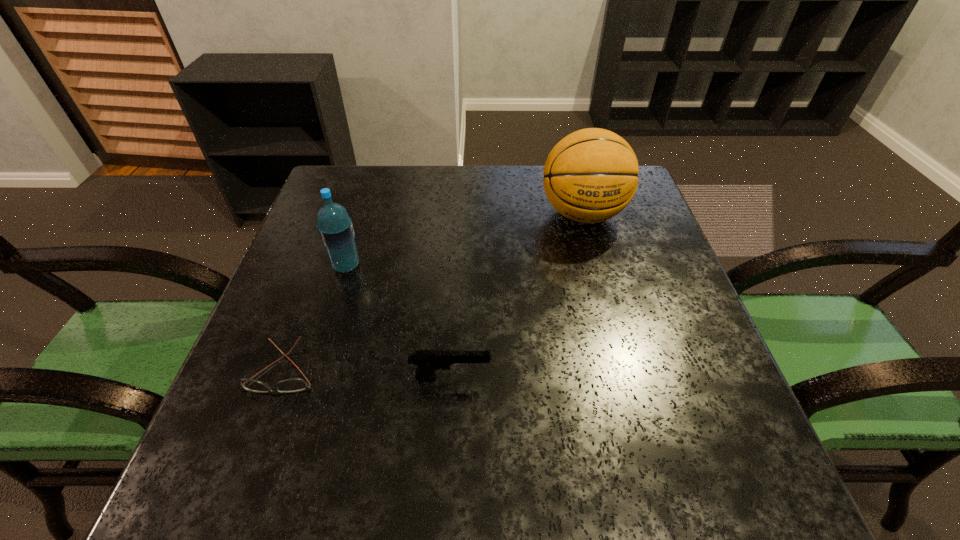
The width and height of the screenshot is (960, 540). In order to click on vacant region at the near left corner of the desktop in this screenshot , I will do point(208,469).

At what (x,y) coordinates should I click in order to perform the action: click on free space between the water bottle and the shortest object. Please return your answer as a coordinate pair (x, y). Image resolution: width=960 pixels, height=540 pixels. Looking at the image, I should click on (315, 318).

In order to click on free area in between the pistol and the farthest object in this screenshot , I will do `click(516, 296)`.

Image resolution: width=960 pixels, height=540 pixels. In order to click on vacant area that lies between the spectacles and the water bottle in this screenshot , I will do `click(315, 318)`.

At what (x,y) coordinates should I click in order to perform the action: click on free point between the second shortest object and the water bottle. Please return your answer as a coordinate pair (x, y). Image resolution: width=960 pixels, height=540 pixels. Looking at the image, I should click on (398, 322).

Where is `vacant space that is in between the third nearest object and the rightmost object`? vacant space that is in between the third nearest object and the rightmost object is located at coordinates (465, 240).

Where is `vacant space that's between the basketball and the second farthest object`? This screenshot has width=960, height=540. vacant space that's between the basketball and the second farthest object is located at coordinates (x=465, y=240).

Image resolution: width=960 pixels, height=540 pixels. Find the location of `empty space that is in between the shortest object and the farthest object`. empty space that is in between the shortest object and the farthest object is located at coordinates (433, 292).

At what (x,y) coordinates should I click in order to perform the action: click on free space between the shortest object and the pistol. Please return your answer as a coordinate pair (x, y). Looking at the image, I should click on (367, 374).

Find the location of a particular element. This screenshot has height=540, width=960. free spot between the water bottle and the second object from right to left is located at coordinates (398, 322).